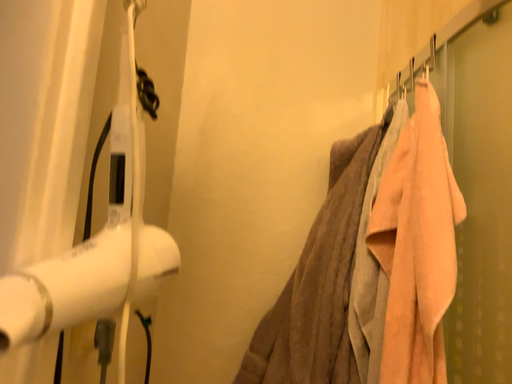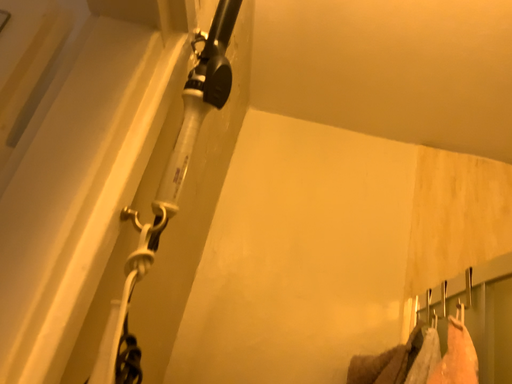
Question: Which way did the camera rotate in the video?

Choices:
 (A) rotated upward
 (B) rotated downward

Answer: (A)